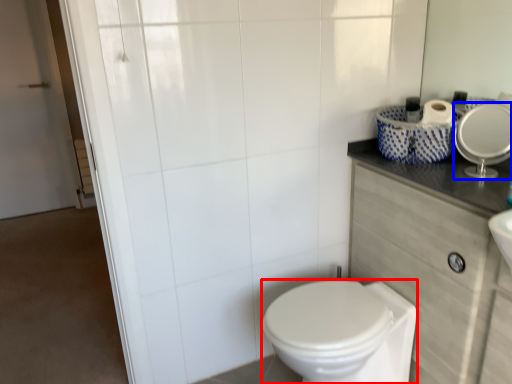
Question: Which object is further to the camera taking this photo, bidet (highlighted by a red box) or mirror (highlighted by a blue box)?

Choices:
 (A) bidet
 (B) mirror

Answer: (B)